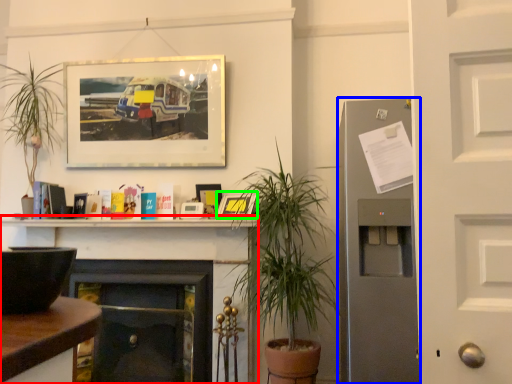
Question: Estimate the real-world distances between objects in this image. Which object is farther from fireplace (highlighted by a red box), fireplace (highlighted by a blue box) or picture frame (highlighted by a green box)?

Choices:
 (A) fireplace
 (B) picture frame

Answer: (A)